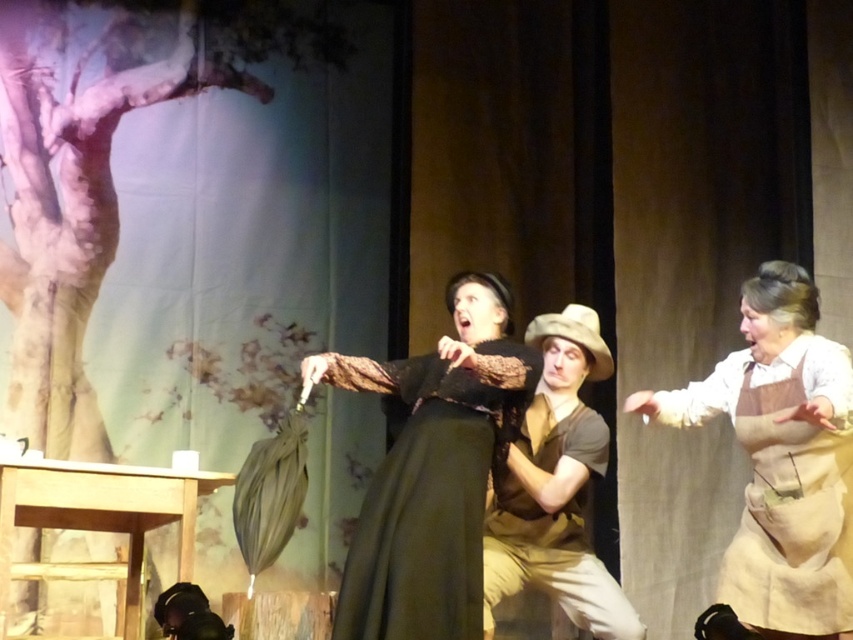
In the scene shown: You are a stagehand observing the performance. You need to place a prop on the stage such that it is exactly at the position marked by point [781,460]. What object should you place the prop next to?

The point [781,460] marks the brown cotton apron at center, so you should place the prop next to the brown cotton apron at center.

You are a stagehand observing the performers on stage. You need to hand a prop to the performer wearing the matte black dress at center and the performer wearing the brown cotton shirt at center. Which performer will you approach first if you want to give the prop to the one closer to you?

The matte black dress at center is closer to the viewer than the brown cotton shirt at center, so you should approach the performer wearing the matte black dress at center first.

You are a stagehand who needs to adjust the lighting to highlight the performer wearing the brown cotton apron at center without obscuring the brown cotton shirt at center. Since the apron is in front of the shirt, how should you position the light to ensure both are visible?

The brown cotton apron at center is in front of the brown cotton shirt at center. To highlight both, position the light source above and slightly behind the performer so the apron casts a shadow revealing the shirt underneath while still illuminating the apron.